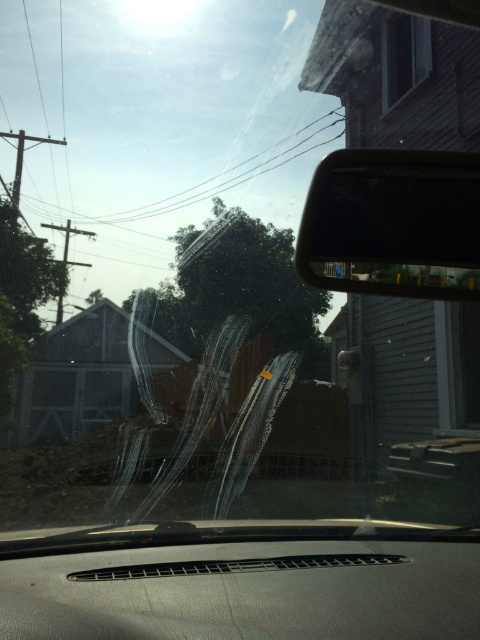
Question: Which point is closer to the camera?

Choices:
 (A) black glossy view mirror at upper right
 (B) matte gray dashboard at center

Answer: (B)

Question: Can you confirm if matte gray dashboard at center is positioned to the right of black glossy view mirror at upper right?

Choices:
 (A) yes
 (B) no

Answer: (B)

Question: Does matte gray dashboard at center have a larger size compared to black glossy view mirror at upper right?

Choices:
 (A) no
 (B) yes

Answer: (A)

Question: From the image, what is the correct spatial relationship of matte gray dashboard at center in relation to black glossy view mirror at upper right?

Choices:
 (A) right
 (B) left

Answer: (B)

Question: Among these points, which one is nearest to the camera?

Choices:
 (A) (72, 554)
 (B) (391, 282)

Answer: (A)